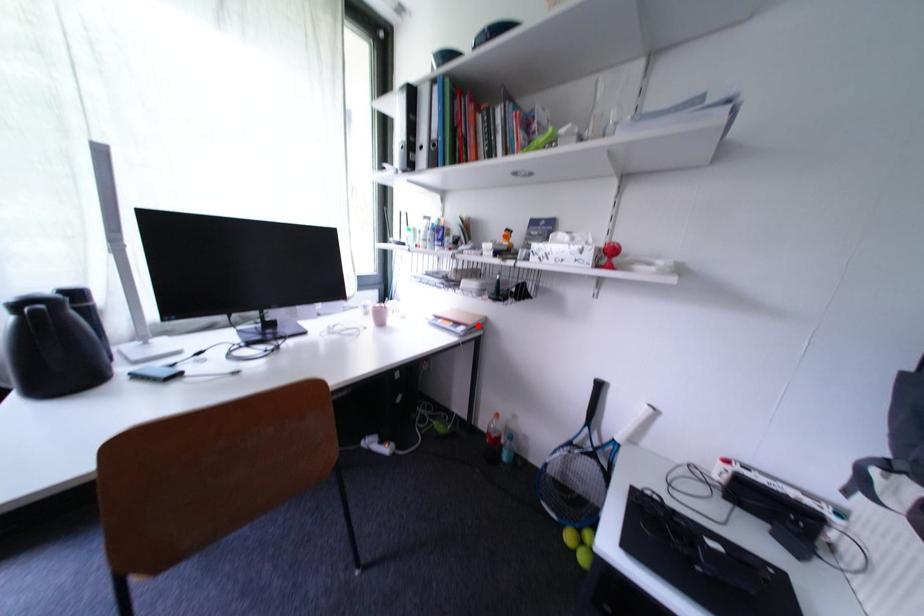
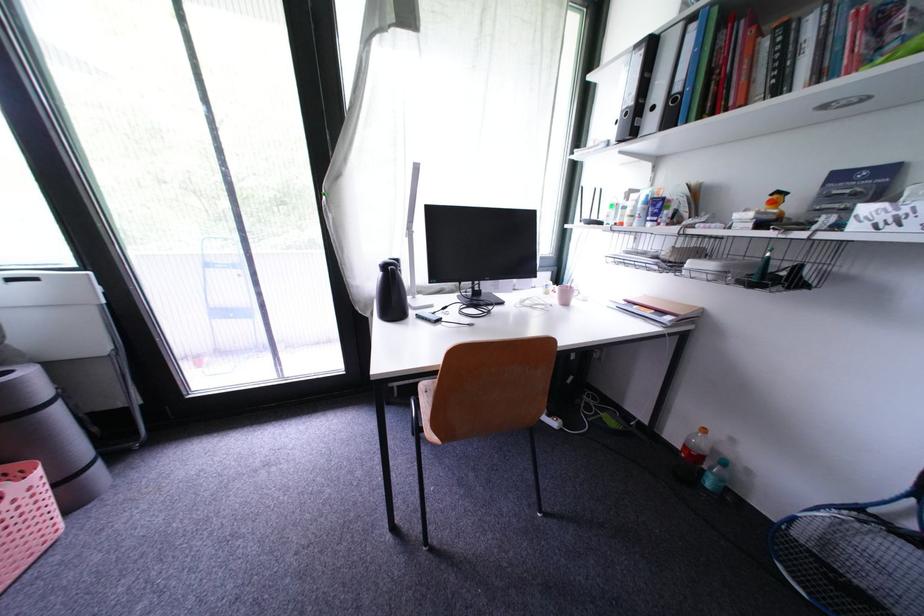
Locate, in the second image, the point that corresponds to the highlighted location in the first image.

(689, 315)